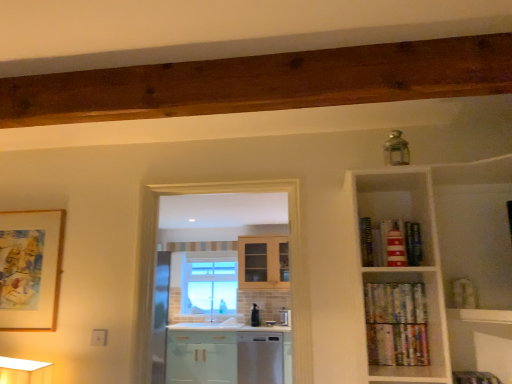
Question: Is hardcover books at right, the second book positioned from the top, not close to red striped lighthouse at upper right, placed as the 1th book when sorted from top to bottom?

Choices:
 (A) yes
 (B) no

Answer: (B)

Question: Is hardcover books at right, the second book positioned from the top, wider than red striped lighthouse at upper right, which appears as the third book when ordered from the bottom?

Choices:
 (A) yes
 (B) no

Answer: (B)

Question: From the image's perspective, is hardcover books at right, positioned as the 2th book in bottom-to-top order, under red striped lighthouse at upper right, which appears as the third book when ordered from the bottom?

Choices:
 (A) yes
 (B) no

Answer: (A)

Question: Does hardcover books at right, the second book positioned from the top, have a larger size compared to red striped lighthouse at upper right, placed as the 1th book when sorted from top to bottom?

Choices:
 (A) yes
 (B) no

Answer: (B)

Question: Is hardcover books at right, the second book positioned from the top, directly adjacent to red striped lighthouse at upper right, placed as the 1th book when sorted from top to bottom?

Choices:
 (A) no
 (B) yes

Answer: (A)

Question: Is multicolored paperbacks at lower right, the first book from the bottom, in front of or behind clear glass window at center in the image?

Choices:
 (A) front
 (B) behind

Answer: (A)

Question: Is multicolored paperbacks at lower right, marked as the 3th book in a top-to-bottom arrangement, bigger or smaller than clear glass window at center?

Choices:
 (A) small
 (B) big

Answer: (A)

Question: Considering the positions of multicolored paperbacks at lower right, the first book from the bottom, and clear glass window at center in the image, is multicolored paperbacks at lower right, the first book from the bottom, wider or thinner than clear glass window at center?

Choices:
 (A) wide
 (B) thin

Answer: (B)

Question: Is point (400, 347) closer or farther from the camera than point (224, 309)?

Choices:
 (A) farther
 (B) closer

Answer: (B)

Question: From the image's perspective, is hardcover books at right, positioned as the 2th book in bottom-to-top order, located above or below multicolored paperbacks at lower right, the first book from the bottom?

Choices:
 (A) below
 (B) above

Answer: (B)

Question: Is hardcover books at right, the second book positioned from the top, bigger or smaller than multicolored paperbacks at lower right, the first book from the bottom?

Choices:
 (A) small
 (B) big

Answer: (B)

Question: Considering the positions of hardcover books at right, positioned as the 2th book in bottom-to-top order, and multicolored paperbacks at lower right, the first book from the bottom, in the image, is hardcover books at right, positioned as the 2th book in bottom-to-top order, taller or shorter than multicolored paperbacks at lower right, the first book from the bottom,?

Choices:
 (A) tall
 (B) short

Answer: (B)

Question: From a real-world perspective, is hardcover books at right, positioned as the 2th book in bottom-to-top order, above or below multicolored paperbacks at lower right, marked as the 3th book in a top-to-bottom arrangement?

Choices:
 (A) below
 (B) above

Answer: (B)

Question: In terms of height, does red striped lighthouse at upper right, placed as the 1th book when sorted from top to bottom, look taller or shorter compared to clear glass window at center?

Choices:
 (A) tall
 (B) short

Answer: (B)

Question: Is red striped lighthouse at upper right, placed as the 1th book when sorted from top to bottom, wider or thinner than clear glass window at center?

Choices:
 (A) thin
 (B) wide

Answer: (A)